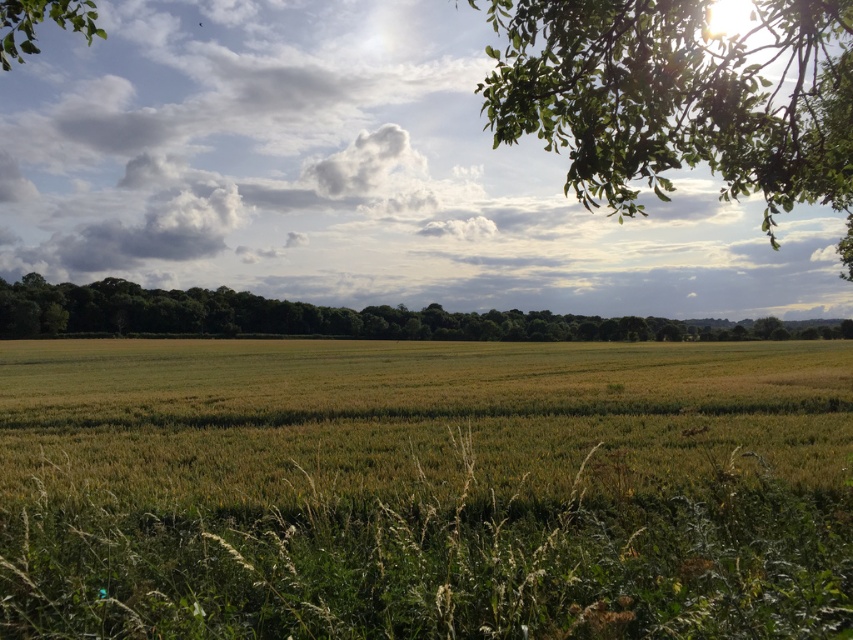
Does point (581, 45) come in front of point (65, 310)?

Yes, it is in front of point (65, 310).

Identify the location of green leafy tree at upper right. The height and width of the screenshot is (640, 853). (680, 97).

Can you confirm if green leafy trees at center is positioned to the left of green leafy tree at upper left?

No, green leafy trees at center is not to the left of green leafy tree at upper left.

This screenshot has width=853, height=640. What do you see at coordinates (323, 317) in the screenshot? I see `green leafy trees at center` at bounding box center [323, 317].

Which is in front, point (136, 289) or point (44, 12)?

Point (44, 12) is more forward.

In order to click on green leafy trees at center in this screenshot , I will do `click(323, 317)`.

Which is above, green grass at center or green leafy tree at upper left?

green leafy tree at upper left is above.

Can you confirm if green grass at center is positioned above green leafy tree at upper left?

No, green grass at center is not above green leafy tree at upper left.

The width and height of the screenshot is (853, 640). Describe the element at coordinates (412, 413) in the screenshot. I see `green grass at center` at that location.

At what (x,y) coordinates should I click in order to perform the action: click on green grass at center. Please return your answer as a coordinate pair (x, y). The image size is (853, 640). Looking at the image, I should click on (412, 413).